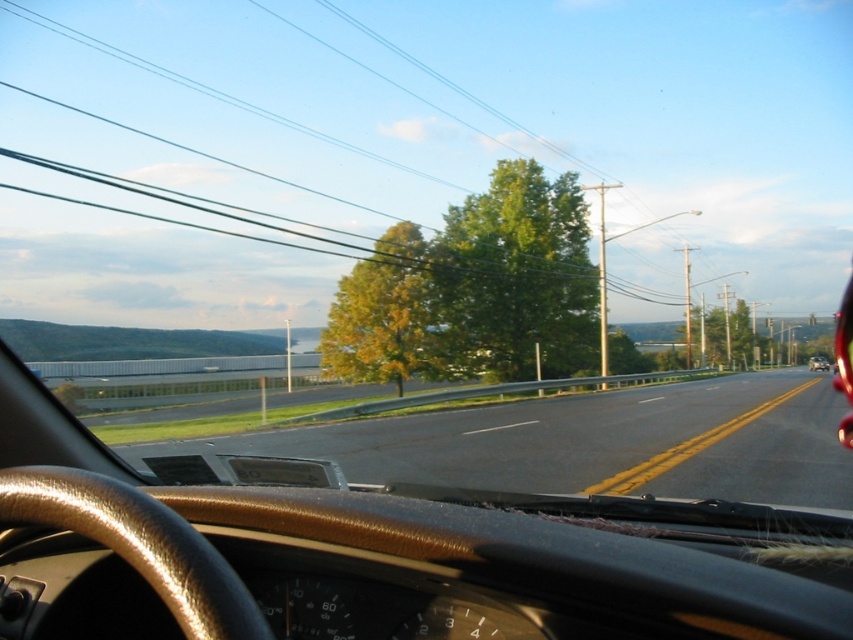
Does green leafy tree at center have a greater height compared to metallic silver suv at right?

Yes, green leafy tree at center is taller than metallic silver suv at right.

Is green leafy tree at center below metallic silver suv at right?

No, green leafy tree at center is not below metallic silver suv at right.

Does point (517, 292) lie behind point (811, 356)?

No, it is in front of (811, 356).

Find the location of `green leafy tree at center`. green leafy tree at center is located at coordinates coord(515,276).

Is the position of black asphalt highway at center less distant than that of yellow-green leaves at center?

That is True.

Is black asphalt highway at center to the right of yellow-green leaves at center from the viewer's perspective?

Yes, black asphalt highway at center is to the right of yellow-green leaves at center.

This screenshot has height=640, width=853. Describe the element at coordinates (589, 442) in the screenshot. I see `black asphalt highway at center` at that location.

Where is `black asphalt highway at center`? The height and width of the screenshot is (640, 853). black asphalt highway at center is located at coordinates (589, 442).

Is point (699, 472) in front of point (527, 182)?

That is True.

Based on the photo, between black asphalt highway at center and green leafy tree at center, which one has more height?

With more height is green leafy tree at center.

Describe the element at coordinates (589, 442) in the screenshot. I see `black asphalt highway at center` at that location.

Where is `black asphalt highway at center`? Image resolution: width=853 pixels, height=640 pixels. black asphalt highway at center is located at coordinates (589, 442).